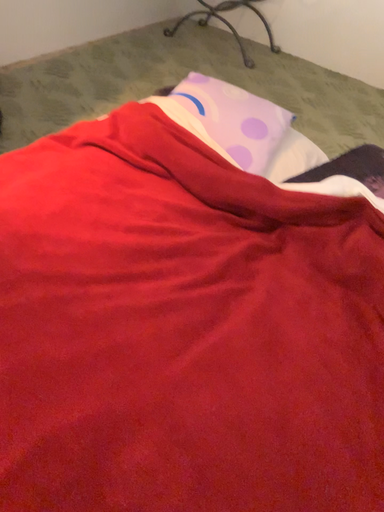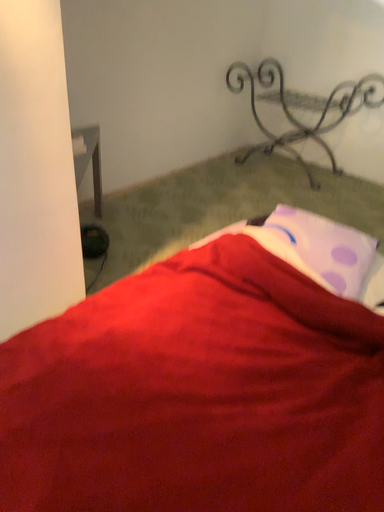
Question: Which way did the camera rotate in the video?

Choices:
 (A) rotated right
 (B) rotated left

Answer: (B)